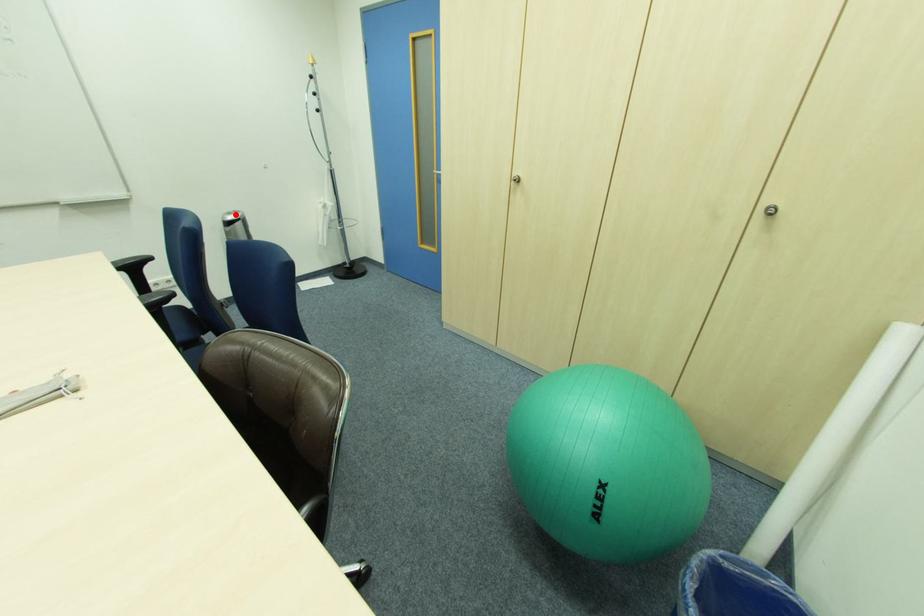
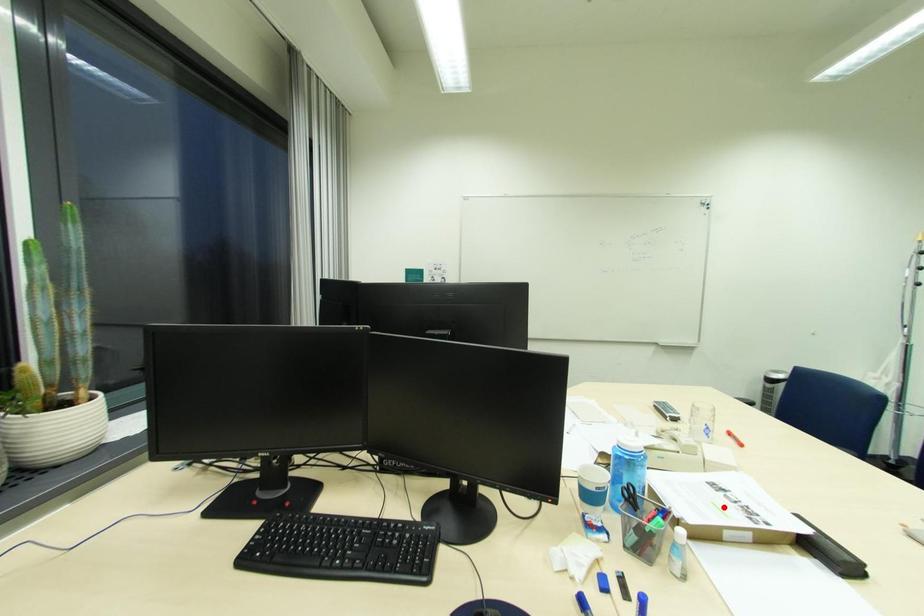
I am providing you with two images of the same scene from different viewpoints. A red point is marked on the first image and another point is marked on the second image. Are the points marked in image1 and image2 representing the same 3D position?

No